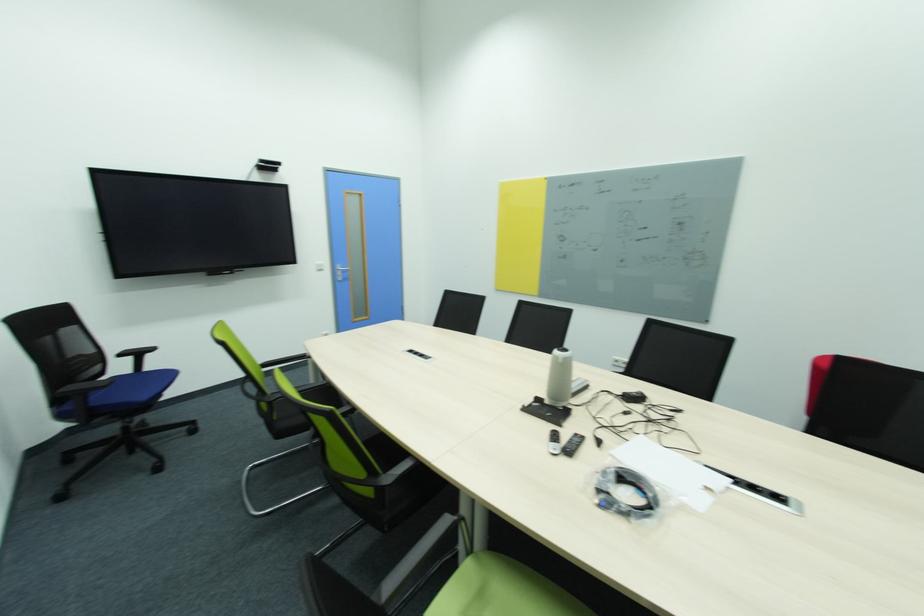
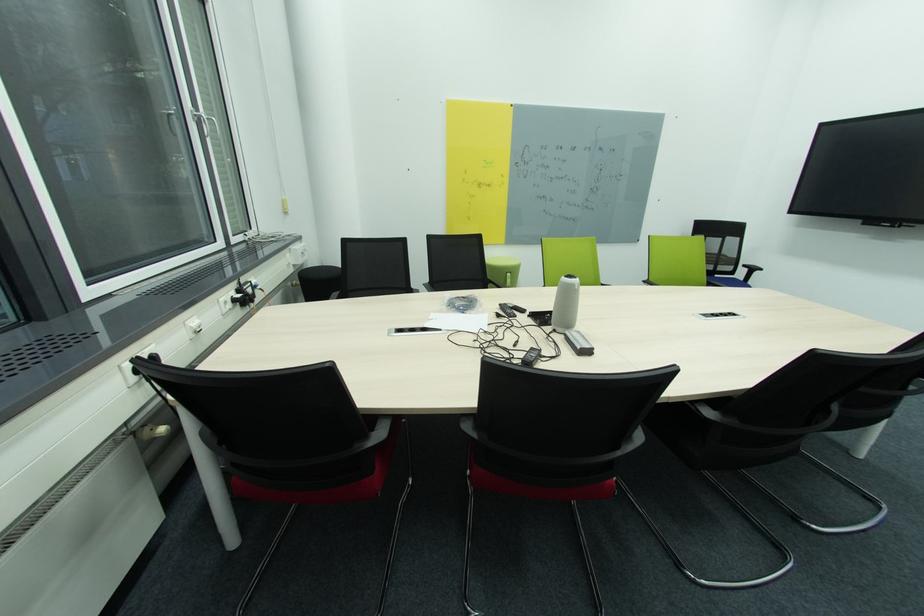
The point at [126,355] is marked in the first image. Where is the corresponding point in the second image?

(749, 267)